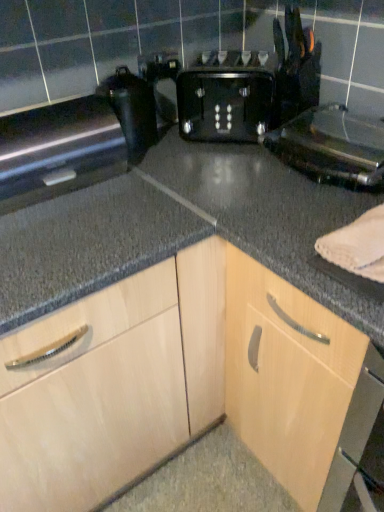
This screenshot has height=512, width=384. What do you see at coordinates (332, 147) in the screenshot?
I see `black plastic toaster at upper center, marked as the 1th appliance in a right-to-left arrangement` at bounding box center [332, 147].

This screenshot has height=512, width=384. What do you see at coordinates (131, 110) in the screenshot?
I see `black glossy coffee maker at upper left, which appears as the 2th appliance when viewed from the left` at bounding box center [131, 110].

Image resolution: width=384 pixels, height=512 pixels. Identify the location of black plastic toaster at center. (245, 94).

Identify the location of black plastic toaster at upper center, marked as the third appliance in a left-to-right arrangement. This screenshot has height=512, width=384. (332, 147).

Based on the photo, relative to black glossy coffee maker at upper left, which appears as the 2th appliance when viewed from the left, is black plastic toaster at center in front or behind?

In the image, black plastic toaster at center appears behind black glossy coffee maker at upper left, which appears as the 2th appliance when viewed from the left.

Is black glossy coffee maker at upper left, which appears as the 2th appliance when viewed from the left, surrounded by black plastic toaster at center?

No, black glossy coffee maker at upper left, which appears as the 2th appliance when viewed from the left, is not surrounded by black plastic toaster at center.

Can you confirm if black plastic toaster at center is bigger than black glossy coffee maker at upper left, placed as the second appliance when sorted from right to left?

Correct, black plastic toaster at center is larger in size than black glossy coffee maker at upper left, placed as the second appliance when sorted from right to left.

Is satin black oven at left, the 1th appliance viewed from the left, smaller than black glossy coffee maker at upper left, which appears as the 2th appliance when viewed from the left?

Actually, satin black oven at left, the 1th appliance viewed from the left, might be larger than black glossy coffee maker at upper left, which appears as the 2th appliance when viewed from the left.

From the image's perspective, is satin black oven at left, the third appliance from the right, above or below black glossy coffee maker at upper left, which appears as the 2th appliance when viewed from the left?

satin black oven at left, the third appliance from the right, is below black glossy coffee maker at upper left, which appears as the 2th appliance when viewed from the left.

From a real-world perspective, is satin black oven at left, the third appliance from the right, positioned above or below black glossy coffee maker at upper left, which appears as the 2th appliance when viewed from the left?

satin black oven at left, the third appliance from the right, is situated lower than black glossy coffee maker at upper left, which appears as the 2th appliance when viewed from the left, in the real world.

Is satin black oven at left, the third appliance from the right, facing towards black glossy coffee maker at upper left, which appears as the 2th appliance when viewed from the left?

No.

Which is further, (x=364, y=142) or (x=376, y=374)?

The point (x=364, y=142) is farther from the camera.

From the picture: Can we say black plastic toaster at upper center, marked as the third appliance in a left-to-right arrangement, lies outside light wood cabinet at center?

Yes, black plastic toaster at upper center, marked as the third appliance in a left-to-right arrangement, is located beyond the bounds of light wood cabinet at center.

Is black plastic toaster at upper center, marked as the 1th appliance in a right-to-left arrangement, in front of or behind light wood cabinet at center in the image?

In the image, black plastic toaster at upper center, marked as the 1th appliance in a right-to-left arrangement, appears behind light wood cabinet at center.

Considering the sizes of black plastic toaster at upper center, marked as the third appliance in a left-to-right arrangement, and light wood cabinet at center in the image, is black plastic toaster at upper center, marked as the third appliance in a left-to-right arrangement, wider or thinner than light wood cabinet at center?

In the image, black plastic toaster at upper center, marked as the third appliance in a left-to-right arrangement, appears to be more narrow than light wood cabinet at center.

From the image's perspective, would you say black plastic toaster at upper center, marked as the third appliance in a left-to-right arrangement, is shown under black glossy coffee maker at upper left, which appears as the 2th appliance when viewed from the left?

Yes.

Is black plastic toaster at upper center, marked as the third appliance in a left-to-right arrangement, bigger than black glossy coffee maker at upper left, which appears as the 2th appliance when viewed from the left?

Yes, black plastic toaster at upper center, marked as the third appliance in a left-to-right arrangement, is bigger than black glossy coffee maker at upper left, which appears as the 2th appliance when viewed from the left.

From a real-world perspective, is black plastic toaster at upper center, marked as the 1th appliance in a right-to-left arrangement, positioned under black glossy coffee maker at upper left, which appears as the 2th appliance when viewed from the left, based on gravity?

Yes, from a real-world perspective, black plastic toaster at upper center, marked as the 1th appliance in a right-to-left arrangement, is below black glossy coffee maker at upper left, which appears as the 2th appliance when viewed from the left.

Is black plastic toaster at upper center, marked as the third appliance in a left-to-right arrangement, in front of black glossy coffee maker at upper left, which appears as the 2th appliance when viewed from the left?

Yes, black plastic toaster at upper center, marked as the third appliance in a left-to-right arrangement, is closer to the camera.

Considering the sizes of black glossy coffee maker at upper left, which appears as the 2th appliance when viewed from the left, and black plastic toaster at center in the image, is black glossy coffee maker at upper left, which appears as the 2th appliance when viewed from the left, wider or thinner than black plastic toaster at center?

black glossy coffee maker at upper left, which appears as the 2th appliance when viewed from the left, is thinner than black plastic toaster at center.

At what (x,y) coordinates should I click in order to perform the action: click on toaster above the black glossy coffee maker at upper left, placed as the second appliance when sorted from right to left (from the image's perspective). Please return your answer as a coordinate pair (x, y). The height and width of the screenshot is (512, 384). Looking at the image, I should click on (245, 94).

From a real-world perspective, is black glossy coffee maker at upper left, placed as the second appliance when sorted from right to left, over black plastic toaster at center?

Yes, from a real-world perspective, black glossy coffee maker at upper left, placed as the second appliance when sorted from right to left, is on top of black plastic toaster at center.

Is black glossy coffee maker at upper left, placed as the second appliance when sorted from right to left, shorter than black plastic toaster at center?

No.

Could satin black oven at left, the third appliance from the right, be considered to be inside black plastic toaster at center?

No, satin black oven at left, the third appliance from the right, is located outside of black plastic toaster at center.

Can you confirm if black plastic toaster at center is bigger than satin black oven at left, the 1th appliance viewed from the left?

Actually, black plastic toaster at center might be smaller than satin black oven at left, the 1th appliance viewed from the left.

Measure the distance between black plastic toaster at center and satin black oven at left, the 1th appliance viewed from the left.

15.22 inches.

From the picture: How many degrees apart are the facing directions of black glossy coffee maker at upper left, which appears as the 2th appliance when viewed from the left, and satin black oven at left, the 1th appliance viewed from the left?

The angular difference between black glossy coffee maker at upper left, which appears as the 2th appliance when viewed from the left, and satin black oven at left, the 1th appliance viewed from the left, is 0.00108 degrees.

Do you think black glossy coffee maker at upper left, which appears as the 2th appliance when viewed from the left, is within satin black oven at left, the third appliance from the right, or outside of it?

black glossy coffee maker at upper left, which appears as the 2th appliance when viewed from the left, is not enclosed by satin black oven at left, the third appliance from the right.

Who is smaller, black glossy coffee maker at upper left, which appears as the 2th appliance when viewed from the left, or satin black oven at left, the third appliance from the right?

Smaller between the two is black glossy coffee maker at upper left, which appears as the 2th appliance when viewed from the left.

Where is `the 1st appliance in front of the black plastic toaster at center`? This screenshot has width=384, height=512. the 1st appliance in front of the black plastic toaster at center is located at coordinates (131, 110).

Image resolution: width=384 pixels, height=512 pixels. What are the coordinates of `appliance that is the 1st object to the right of the satin black oven at left, the third appliance from the right, starting at the anchor` in the screenshot? It's located at coord(131,110).

Based on the photo, which object lies further to the anchor point black glossy coffee maker at upper left, which appears as the 2th appliance when viewed from the left, black plastic toaster at upper center, marked as the third appliance in a left-to-right arrangement, or satin black oven at left, the 1th appliance viewed from the left?

black plastic toaster at upper center, marked as the third appliance in a left-to-right arrangement.

Considering their positions, is black plastic toaster at center positioned further to black plastic toaster at upper center, marked as the third appliance in a left-to-right arrangement, than black glossy coffee maker at upper left, which appears as the 2th appliance when viewed from the left?

black glossy coffee maker at upper left, which appears as the 2th appliance when viewed from the left.

From the image, which object appears to be farther from satin black oven at left, the 1th appliance viewed from the left, black plastic toaster at center or light wood cabinet at center?

light wood cabinet at center is positioned further to the anchor satin black oven at left, the 1th appliance viewed from the left.

From the image, which object appears to be farther from light wood cabinet at center, black plastic toaster at center or black glossy coffee maker at upper left, which appears as the 2th appliance when viewed from the left?

black glossy coffee maker at upper left, which appears as the 2th appliance when viewed from the left, is further to light wood cabinet at center.

From the image, which object appears to be nearer to satin black oven at left, the third appliance from the right, black plastic toaster at upper center, marked as the 1th appliance in a right-to-left arrangement, or black plastic toaster at center?

The object closer to satin black oven at left, the third appliance from the right, is black plastic toaster at center.

Based on their spatial positions, is black plastic toaster at upper center, marked as the 1th appliance in a right-to-left arrangement, or black plastic toaster at center closer to light wood cabinet at center?

black plastic toaster at upper center, marked as the 1th appliance in a right-to-left arrangement, lies closer to light wood cabinet at center than the other object.

Based on their spatial positions, is black plastic toaster at center or light wood cabinet at center further from black plastic toaster at upper center, marked as the third appliance in a left-to-right arrangement?

light wood cabinet at center.

Looking at the image, which one is located closer to black glossy coffee maker at upper left, which appears as the 2th appliance when viewed from the left, light wood cabinet at center or black plastic toaster at upper center, marked as the 1th appliance in a right-to-left arrangement?

black plastic toaster at upper center, marked as the 1th appliance in a right-to-left arrangement, lies closer to black glossy coffee maker at upper left, which appears as the 2th appliance when viewed from the left, than the other object.

You are a GUI agent. You are given a task and a screenshot of the screen. Output one action in this format:
    pyautogui.click(x=<x>, y=<y>)
    Task: Click on the cabinetry between satin black oven at left, the 1th appliance viewed from the left, and black plastic toaster at upper center, marked as the third appliance in a left-to-right arrangement
    This screenshot has width=384, height=512.
    Given the screenshot: What is the action you would take?
    pyautogui.click(x=185, y=384)

The width and height of the screenshot is (384, 512). Find the location of `toaster between satin black oven at left, the 1th appliance viewed from the left, and light wood cabinet at center, in the horizontal direction`. toaster between satin black oven at left, the 1th appliance viewed from the left, and light wood cabinet at center, in the horizontal direction is located at coordinates (245, 94).

Identify the location of toaster between satin black oven at left, the third appliance from the right, and black plastic toaster at upper center, marked as the 1th appliance in a right-to-left arrangement, from left to right. (245, 94).

Locate an element on the screen. appliance located between satin black oven at left, the 1th appliance viewed from the left, and black plastic toaster at upper center, marked as the 1th appliance in a right-to-left arrangement, in the left-right direction is located at coordinates (131, 110).